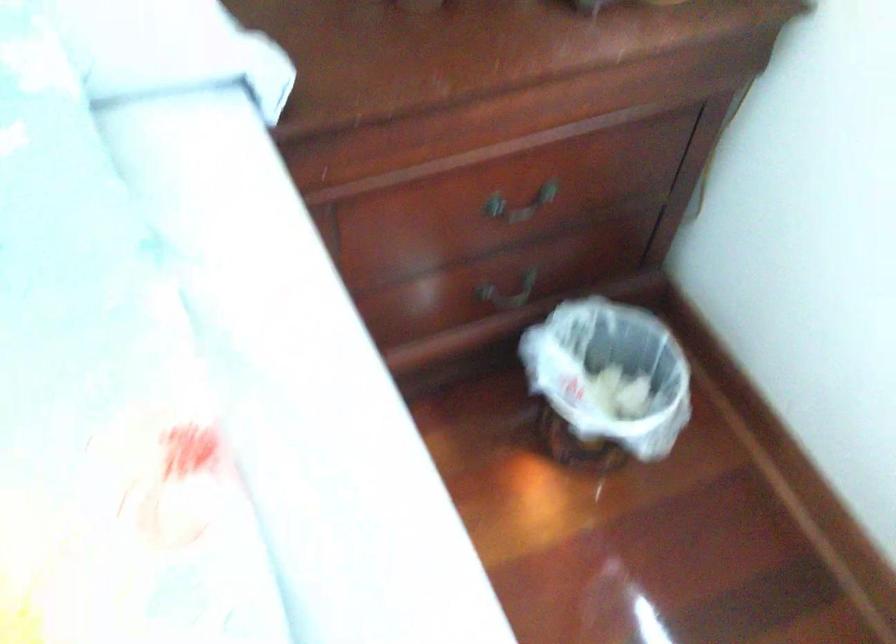
Find where to lift the small trash bin. Please return your answer as a coordinate pair (x, y).

(606, 383)